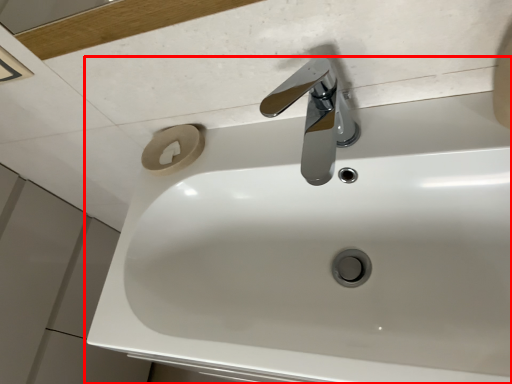
Question: From the image's perspective, considering the relative positions of sink (annotated by the red box) and tap in the image provided, where is sink (annotated by the red box) located with respect to the staircase?

Choices:
 (A) above
 (B) below

Answer: (B)